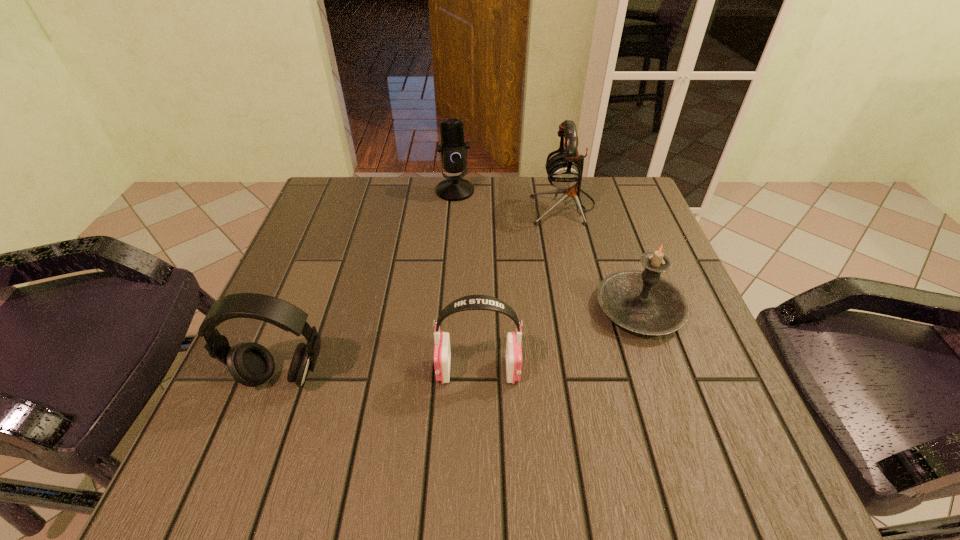
The height and width of the screenshot is (540, 960). I want to click on free space that satisfies the following two spatial constraints: 1. on the front side of the third farthest object; 2. on the right side of the rightmost earphone, so click(x=588, y=309).

Find the location of `free location that satisfies the following two spatial constraints: 1. on the front side of the farthest earphone; 2. on the outer surface of the second earphone from right to left`. free location that satisfies the following two spatial constraints: 1. on the front side of the farthest earphone; 2. on the outer surface of the second earphone from right to left is located at coordinates (602, 370).